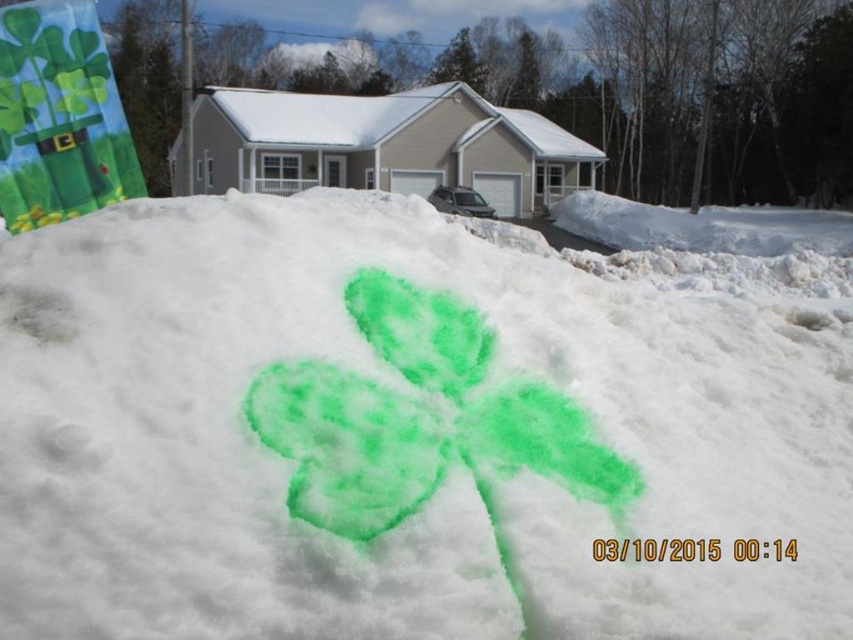
Can you confirm if green powder at center is positioned above green powder clover at center?

Yes, green powder at center is above green powder clover at center.

Consider the image. Who is shorter, green powder at center or green powder clover at center?

green powder clover at center is shorter.

Which is behind, point (477, 417) or point (553, 476)?

Point (477, 417)

You are a GUI agent. You are given a task and a screenshot of the screen. Output one action in this format:
    pyautogui.click(x=<x>, y=<y>)
    Task: Click on the green powder at center
    
    Given the screenshot: What is the action you would take?
    pyautogui.click(x=419, y=424)